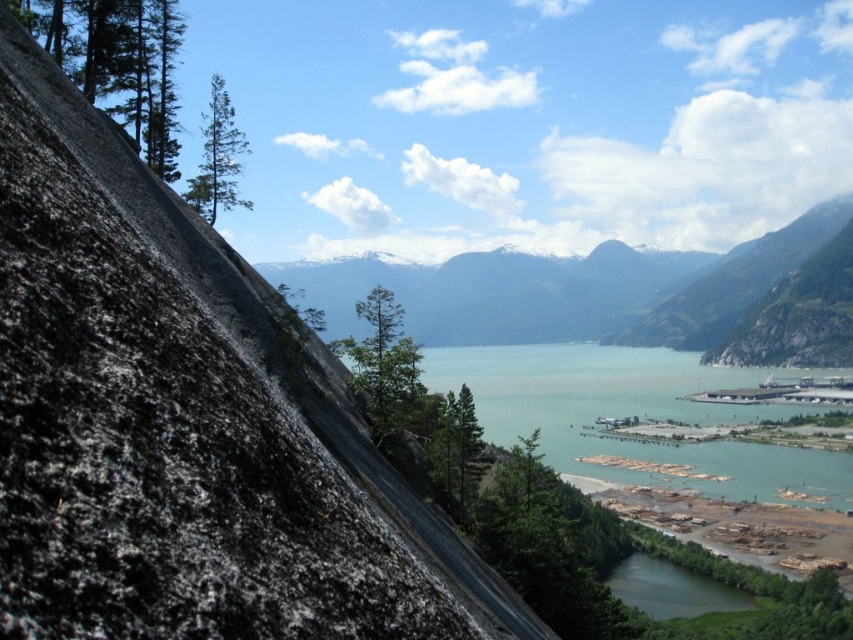
Between snowy granite mountain at upper center and greenish-blue water at center, which one is positioned lower?

greenish-blue water at center

Does point (657, 289) lie behind point (621, 586)?

Yes, it is.

This screenshot has height=640, width=853. I want to click on snowy granite mountain at upper center, so click(567, 288).

Who is more distant from viewer, (55, 280) or (671, 572)?

The point (671, 572) is more distant.

Who is positioned more to the left, black granite rock at left or greenish-blue water at center?

black granite rock at left is more to the left.

Where is `black granite rock at left`? This screenshot has width=853, height=640. black granite rock at left is located at coordinates (183, 419).

Is point (137, 545) positioned behind point (548, 307)?

No, it is in front of (548, 307).

The width and height of the screenshot is (853, 640). In order to click on black granite rock at left in this screenshot , I will do [183, 419].

Locate an element on the screen. Image resolution: width=853 pixels, height=640 pixels. black granite rock at left is located at coordinates (183, 419).